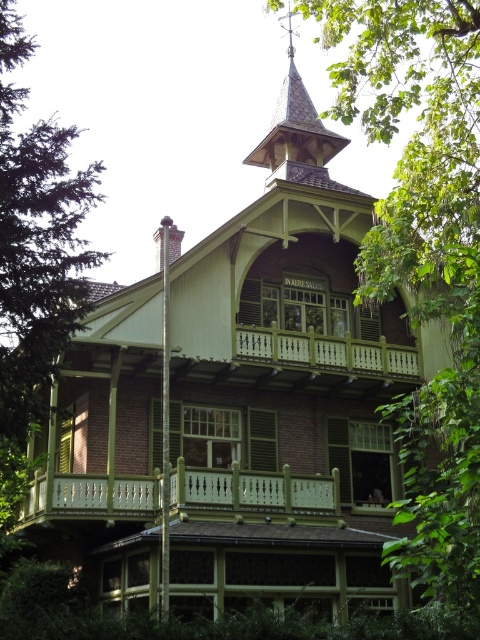
You are standing in front of the house and want to touch both the green painted wood balustrade at center and the wooden spire at upper center. Which object will you reach first?

The green painted wood balustrade at center is closer to the viewer than the wooden spire at upper center, so you will reach the green painted wood balustrade at center first.

You are standing on the front lawn of the house and notice the green painted wood balustrade at center and the wooden spire at upper center. Which object is located to the left of the other?

The green painted wood balustrade at center is positioned on the left side of wooden spire at upper center.

You are standing in front of the house and notice both the green leafy tree at upper center and the green painted wood balustrade at center. Which object appears closer to you based on their positions?

The green leafy tree at upper center appears closer because it is positioned in front of the green painted wood balustrade at center.